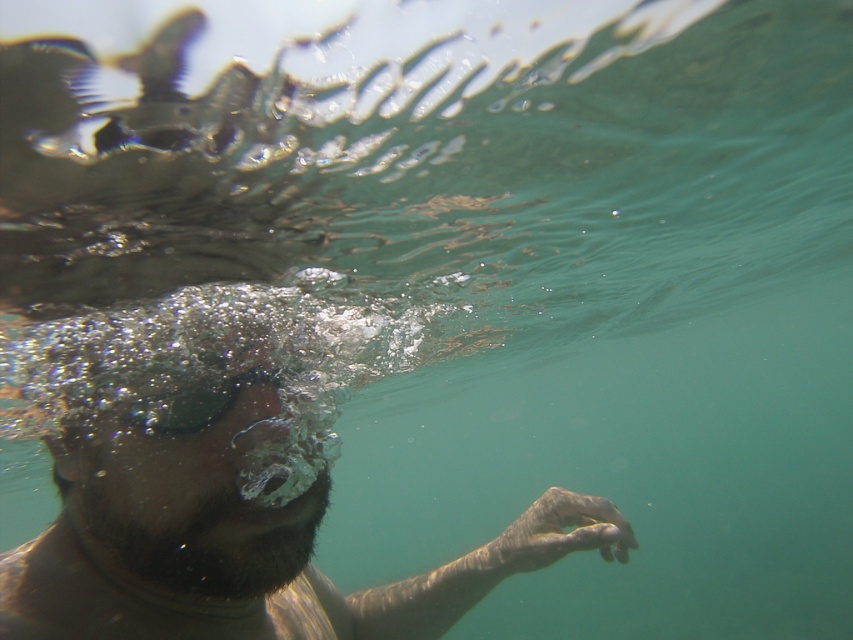
Who is more forward, (315, 444) or (277, 376)?

Point (315, 444)

You are a GUI agent. You are given a task and a screenshot of the screen. Output one action in this format:
    pyautogui.click(x=<x>, y=<y>)
    Task: Click on the brown matte skin at center
    This screenshot has height=640, width=853.
    Given the screenshot: What is the action you would take?
    pyautogui.click(x=230, y=488)